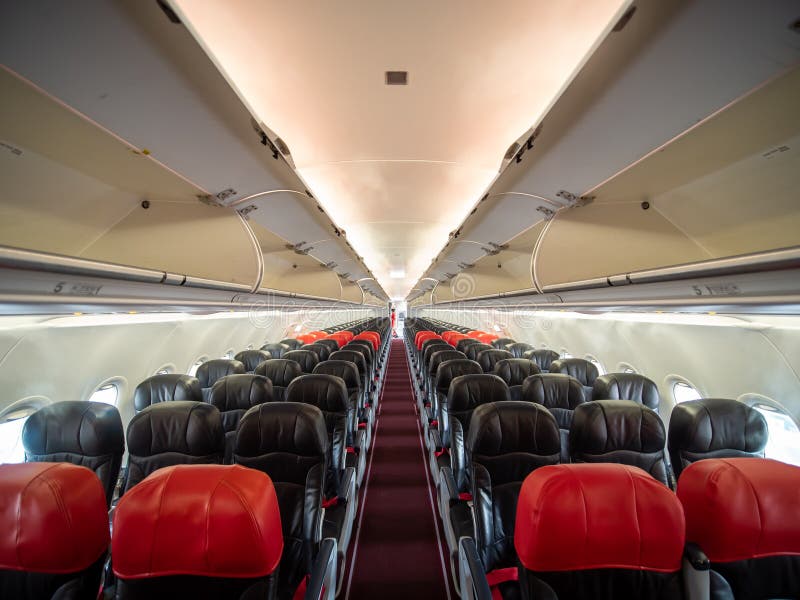
Image resolution: width=800 pixels, height=600 pixels. Find the location of `plane overhead bins`. plane overhead bins is located at coordinates (x=105, y=229), (x=274, y=252), (x=353, y=289), (x=366, y=296), (x=626, y=254), (x=500, y=270), (x=452, y=287), (x=426, y=295), (x=418, y=301), (x=376, y=301).